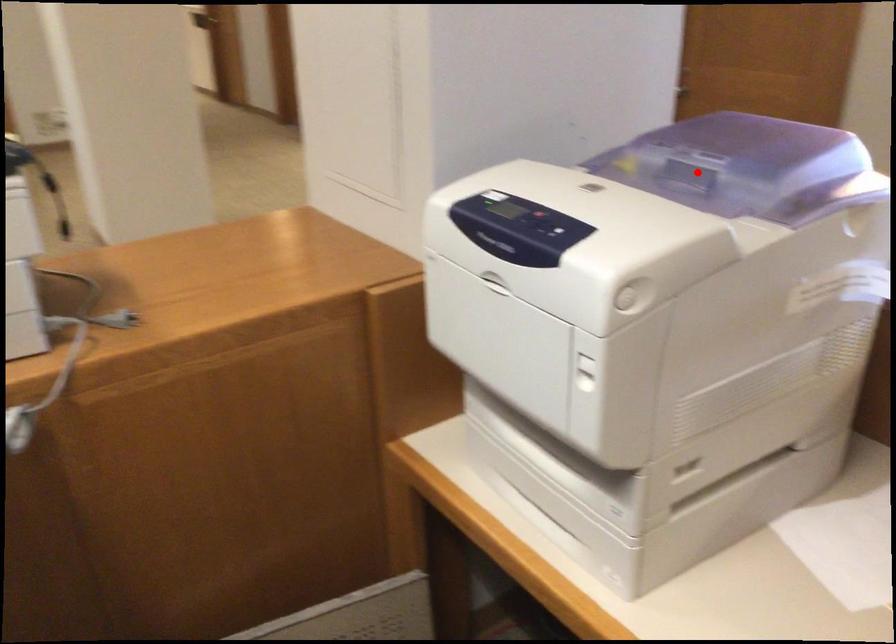
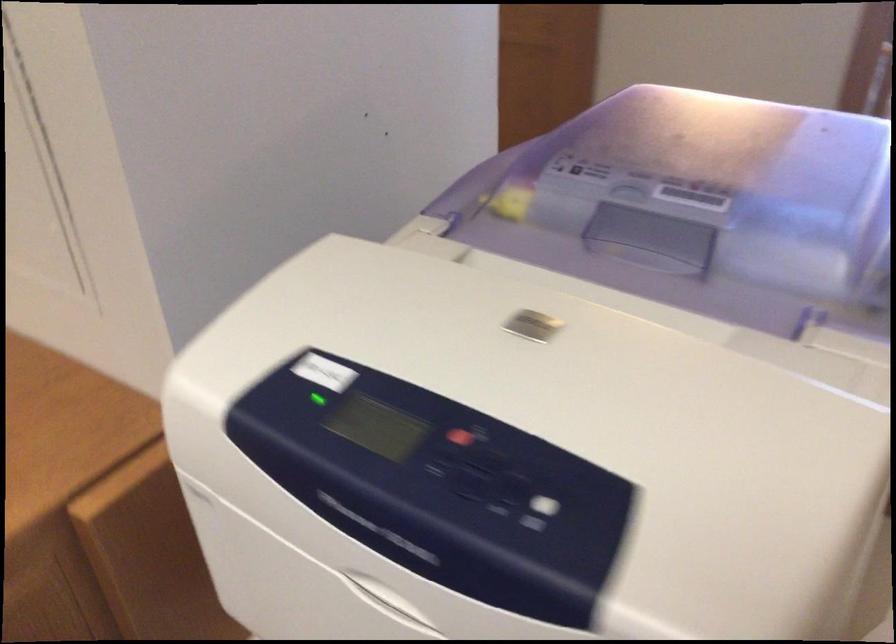
The point at the highlighted location is marked in the first image. Where is the corresponding point in the second image?

(656, 234)